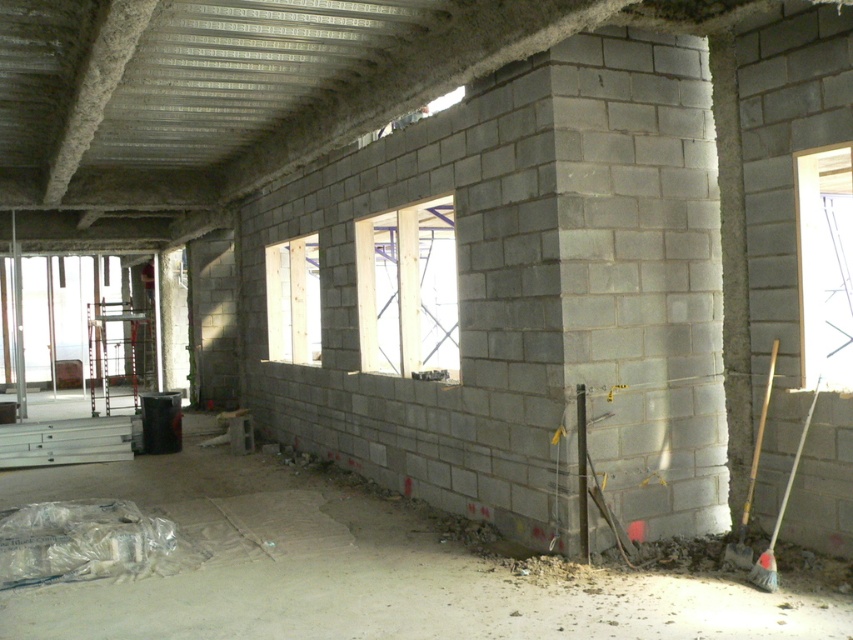
Who is lower down, gray concrete basement at lower center or wooden handle broom at lower right?

gray concrete basement at lower center is below.

Can you confirm if gray concrete basement at lower center is positioned to the right of wooden handle broom at lower right?

Incorrect, gray concrete basement at lower center is not on the right side of wooden handle broom at lower right.

Does point (480, 570) come farther from viewer compared to point (775, 534)?

Yes, it is behind point (775, 534).

Where is `gray concrete basement at lower center`? gray concrete basement at lower center is located at coordinates (367, 566).

Who is positioned more to the right, gray concrete basement at lower center or clear wood window at center?

clear wood window at center is more to the right.

Can you confirm if gray concrete basement at lower center is thinner than clear wood window at center?

No, gray concrete basement at lower center is not thinner than clear wood window at center.

This screenshot has height=640, width=853. What are the coordinates of `gray concrete basement at lower center` in the screenshot? It's located at (367, 566).

Describe the element at coordinates (367, 566) in the screenshot. I see `gray concrete basement at lower center` at that location.

Between gray concrete basement at lower center and light wood window at center, which one appears on the left side from the viewer's perspective?

light wood window at center is more to the left.

At what (x,y) coordinates should I click in order to perform the action: click on gray concrete basement at lower center. Please return your answer as a coordinate pair (x, y). Looking at the image, I should click on (367, 566).

Locate an element on the screen. gray concrete basement at lower center is located at coordinates (367, 566).